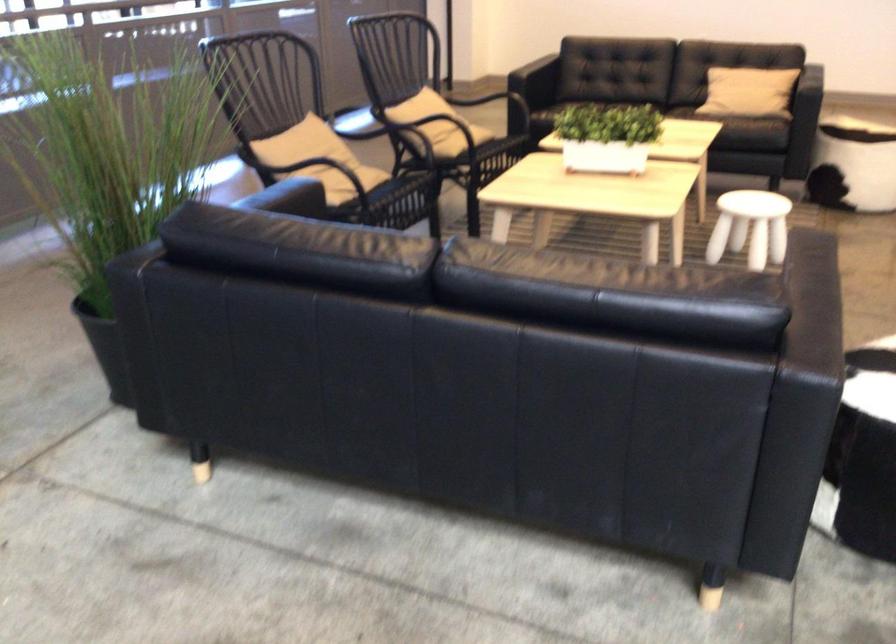
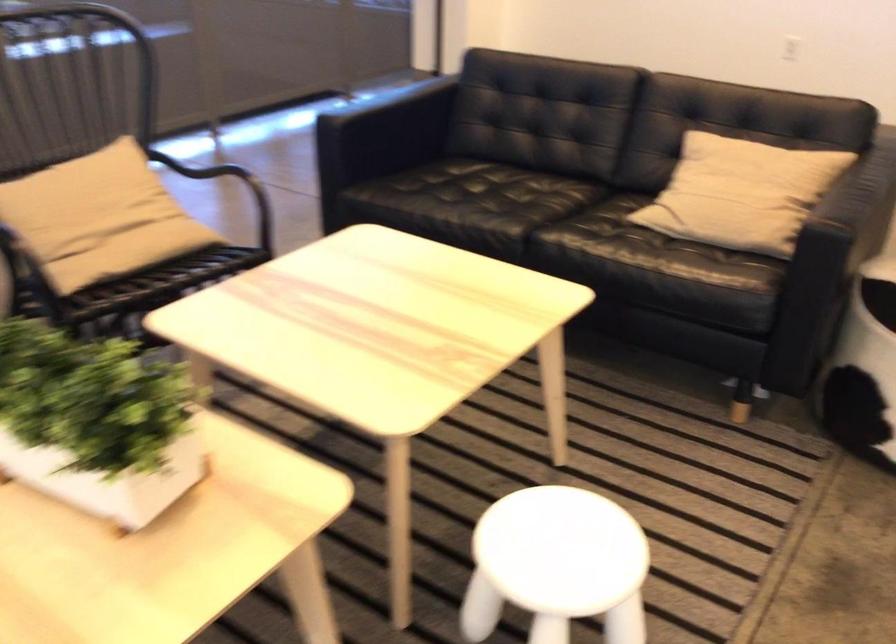
Find the pixel in the second image that matches pixel 488 129 in the first image.

(151, 254)